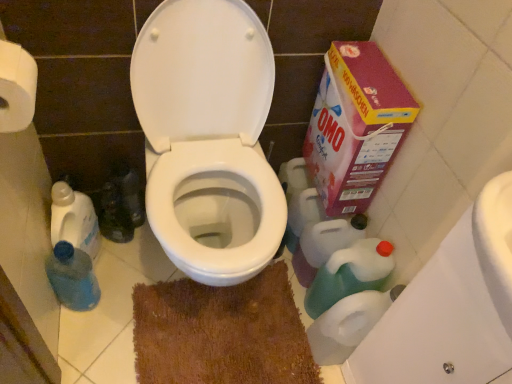
Question: Does white plastic toilet paper at lower right, arranged as the 2th toilet paper when viewed from the front, appear on the right side of blue plastic bottle at lower left, marked as the 2th cleaning product in a left-to-right arrangement?

Choices:
 (A) no
 (B) yes

Answer: (B)

Question: Does white plastic toilet paper at lower right, which appears as the 1th toilet paper when viewed from the back, have a lesser height compared to blue plastic bottle at lower left, marked as the 2th cleaning product in a left-to-right arrangement?

Choices:
 (A) no
 (B) yes

Answer: (A)

Question: Does white plastic toilet paper at lower right, the 1th toilet paper from the right, have a larger size compared to blue plastic bottle at lower left, marked as the 2th cleaning product in a left-to-right arrangement?

Choices:
 (A) yes
 (B) no

Answer: (A)

Question: Does white plastic toilet paper at lower right, which appears as the 1th toilet paper when viewed from the back, have a lesser width compared to blue plastic bottle at lower left, placed as the second cleaning product when sorted from right to left?

Choices:
 (A) no
 (B) yes

Answer: (A)

Question: Is the position of white plastic toilet paper at lower right, the 1th toilet paper from the right, more distant than that of blue plastic bottle at lower left, placed as the second cleaning product when sorted from right to left?

Choices:
 (A) yes
 (B) no

Answer: (B)

Question: From a real-world perspective, relative to brown textured bath mat at center, is white glossy toilet at center vertically above or below?

Choices:
 (A) above
 (B) below

Answer: (A)

Question: Is white glossy toilet at center in front of or behind brown textured bath mat at center in the image?

Choices:
 (A) behind
 (B) front

Answer: (B)

Question: Considering the positions of white glossy toilet at center and brown textured bath mat at center in the image, is white glossy toilet at center bigger or smaller than brown textured bath mat at center?

Choices:
 (A) small
 (B) big

Answer: (B)

Question: Looking at their shapes, would you say white glossy toilet at center is wider or thinner than brown textured bath mat at center?

Choices:
 (A) wide
 (B) thin

Answer: (A)

Question: Based on their positions, is white glossy toilet at center located to the left or right of green plastic bottle at lower right, which appears as the 3th cleaning product when viewed from the left?

Choices:
 (A) left
 (B) right

Answer: (A)

Question: Relative to green plastic bottle at lower right, which appears as the 3th cleaning product when viewed from the left, is white glossy toilet at center in front or behind?

Choices:
 (A) front
 (B) behind

Answer: (A)

Question: In terms of width, does white glossy toilet at center look wider or thinner when compared to green plastic bottle at lower right, the 1th cleaning product viewed from the right?

Choices:
 (A) wide
 (B) thin

Answer: (A)

Question: Based on their sizes in the image, would you say white glossy toilet at center is bigger or smaller than green plastic bottle at lower right, the 1th cleaning product viewed from the right?

Choices:
 (A) big
 (B) small

Answer: (A)

Question: Is brown textured bath mat at center wider or thinner than blue plastic bottle at lower left, marked as the 2th cleaning product in a left-to-right arrangement?

Choices:
 (A) thin
 (B) wide

Answer: (B)

Question: From the image's perspective, is brown textured bath mat at center above or below blue plastic bottle at lower left, marked as the 2th cleaning product in a left-to-right arrangement?

Choices:
 (A) above
 (B) below

Answer: (B)